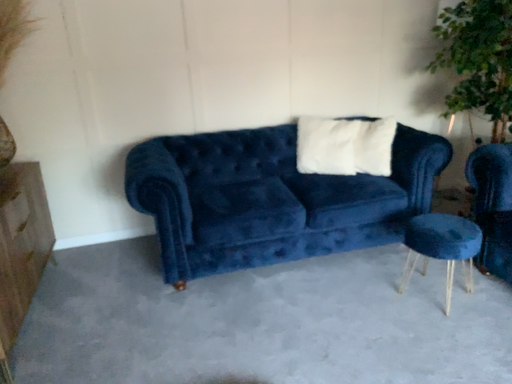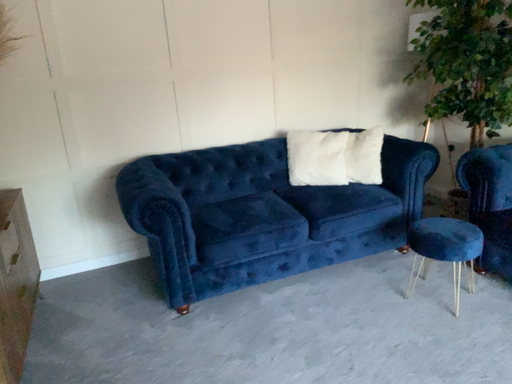
Question: Which way did the camera rotate in the video?

Choices:
 (A) rotated left
 (B) rotated right

Answer: (B)